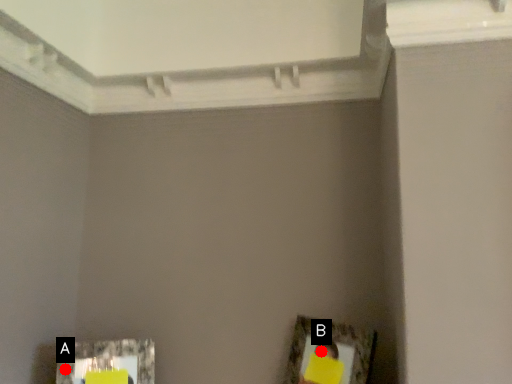
Question: Two points are circled on the image, labeled by A and B beside each circle. Which of the following is the closest to the observer?

Choices:
 (A) A is closer
 (B) B is closer

Answer: (B)